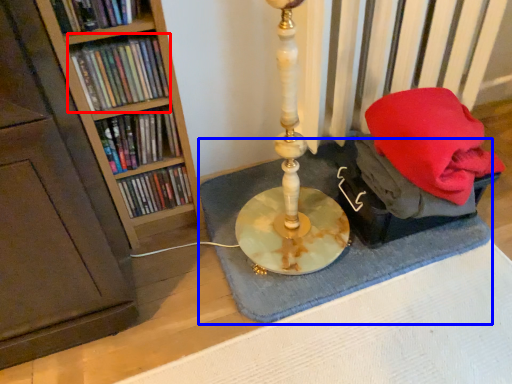
Question: Among these objects, which one is nearest to the camera, book (highlighted by a red box) or bath mat (highlighted by a blue box)?

Choices:
 (A) book
 (B) bath mat

Answer: (A)